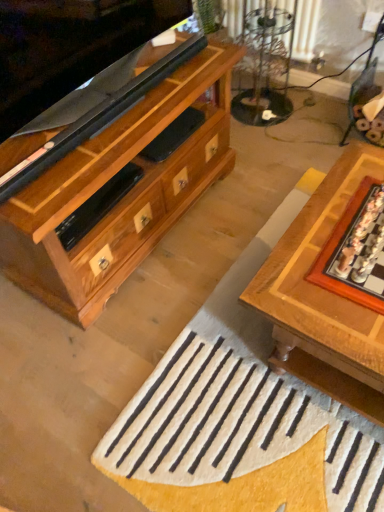
Locate an element on the screen. The image size is (384, 512). free space that is to the left of wooden chessboard at center is located at coordinates (164, 296).